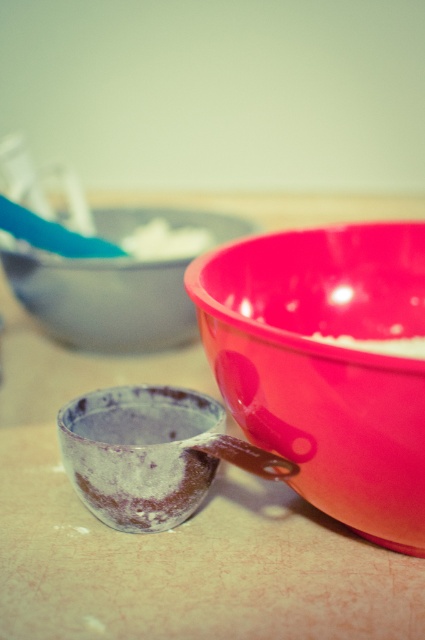
Where is the glossy plastic bowl at right located in the image?

The glossy plastic bowl at right is located at point (325, 364).

You are a chef preparing a dish and need to reach for either the glossy plastic bowl at right or the blue plastic spoon at upper left. Which item will you grab first if you want to pick up the one closer to you?

The glossy plastic bowl at right is closer to the viewer than the blue plastic spoon at upper left, so you should grab the glossy plastic bowl at right first.

You are a baker who needs to choose between the glossy plastic bowl at right and the matte plastic bowl at upper center for a recipe that requires a larger container. Which bowl should you select?

The glossy plastic bowl at right is larger in size than the matte plastic bowl at upper center, so you should select the glossy plastic bowl at right for the recipe.